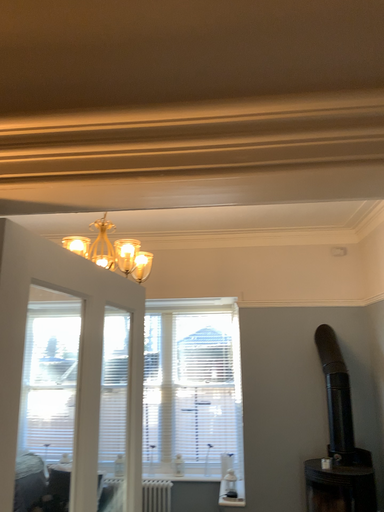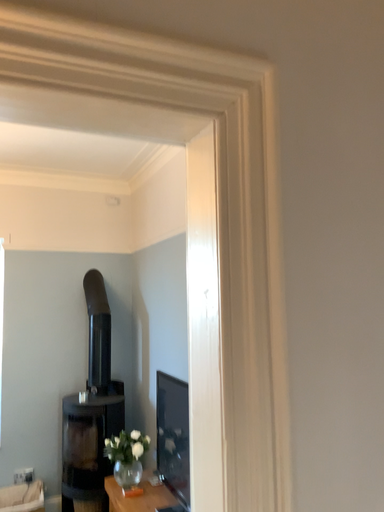
Question: How did the camera likely rotate when shooting the video?

Choices:
 (A) rotated upward
 (B) rotated downward

Answer: (B)